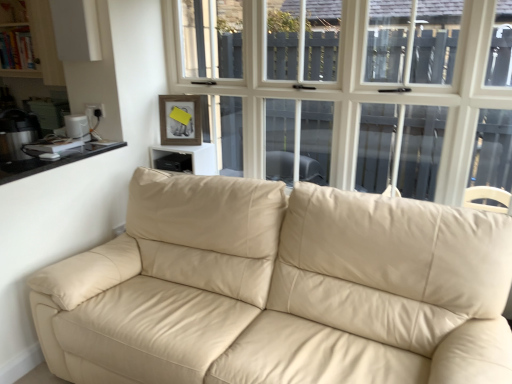
Identify the location of vacant area located to the right-hand side of white plastic toaster at left, the second appliance when ordered from left to right. The image size is (512, 384). (100, 147).